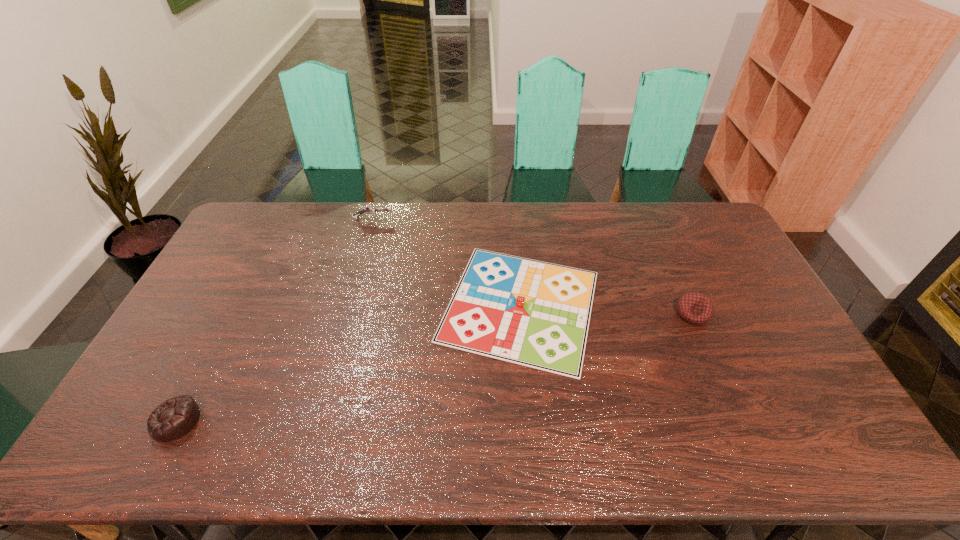
Where is `free space at the near left corner of the desktop`? This screenshot has width=960, height=540. free space at the near left corner of the desktop is located at coordinates (161, 449).

The width and height of the screenshot is (960, 540). In order to click on unoccupied position between the shortest object and the nearest object in this screenshot , I will do (x=348, y=363).

At what (x,y) coordinates should I click in order to perform the action: click on free point between the farther beanbag and the shortest object. Please return your answer as a coordinate pair (x, y). The height and width of the screenshot is (540, 960). Looking at the image, I should click on (607, 309).

Image resolution: width=960 pixels, height=540 pixels. What are the coordinates of `vacant space in between the second object from left to right and the gameboard` in the screenshot? It's located at (446, 262).

You are a GUI agent. You are given a task and a screenshot of the screen. Output one action in this format:
    pyautogui.click(x=<x>, y=<y>)
    Task: Click on the vacant region between the gameboard and the farther beanbag
    This screenshot has width=960, height=540.
    Given the screenshot: What is the action you would take?
    pyautogui.click(x=607, y=309)

Where is `empty space that is in between the farthest object and the gameboard`? Image resolution: width=960 pixels, height=540 pixels. empty space that is in between the farthest object and the gameboard is located at coordinates (446, 262).

At what (x,y) coordinates should I click in order to perform the action: click on vacant space that's between the farthest object and the third tallest object. Please return your answer as a coordinate pair (x, y). The image size is (960, 540). Looking at the image, I should click on (275, 320).

Where is `unoccupied position between the farther beanbag and the third object from left to right`? unoccupied position between the farther beanbag and the third object from left to right is located at coordinates (607, 309).

The image size is (960, 540). I want to click on vacant area between the shortest object and the right beanbag, so click(x=607, y=309).

Locate an element on the screen. The width and height of the screenshot is (960, 540). unoccupied position between the nearer beanbag and the shortest object is located at coordinates (348, 363).